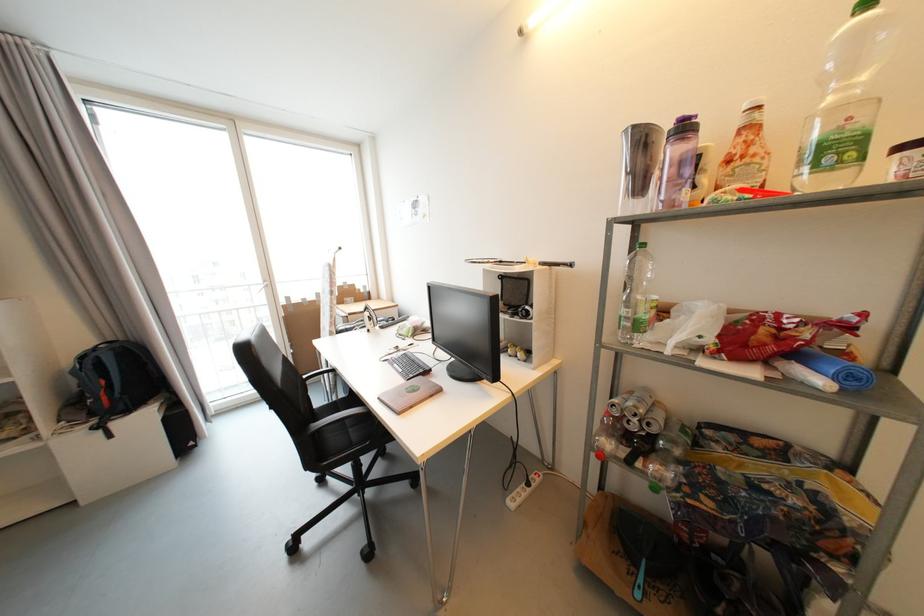
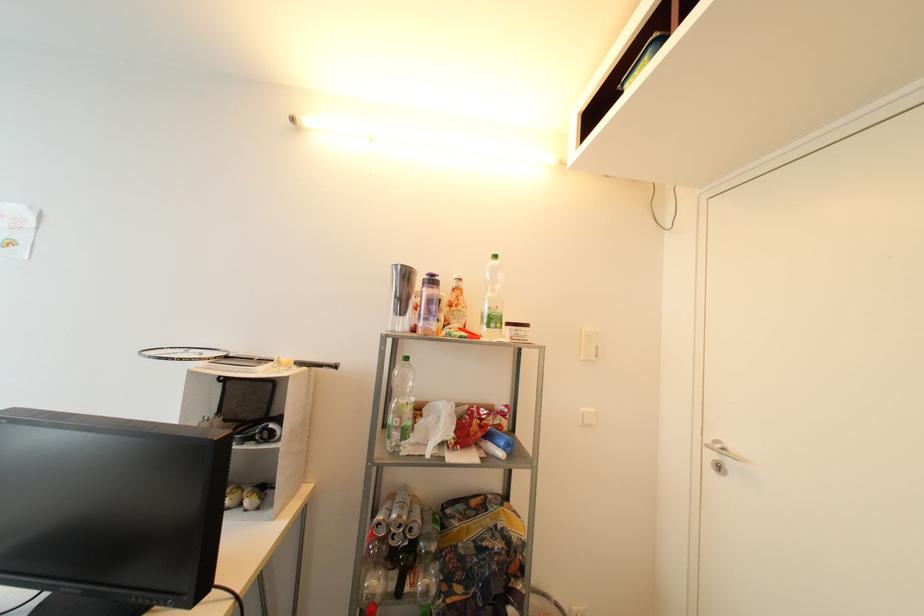
Where in the second image is the point corresponding to point 639,129 from the first image?

(407, 268)